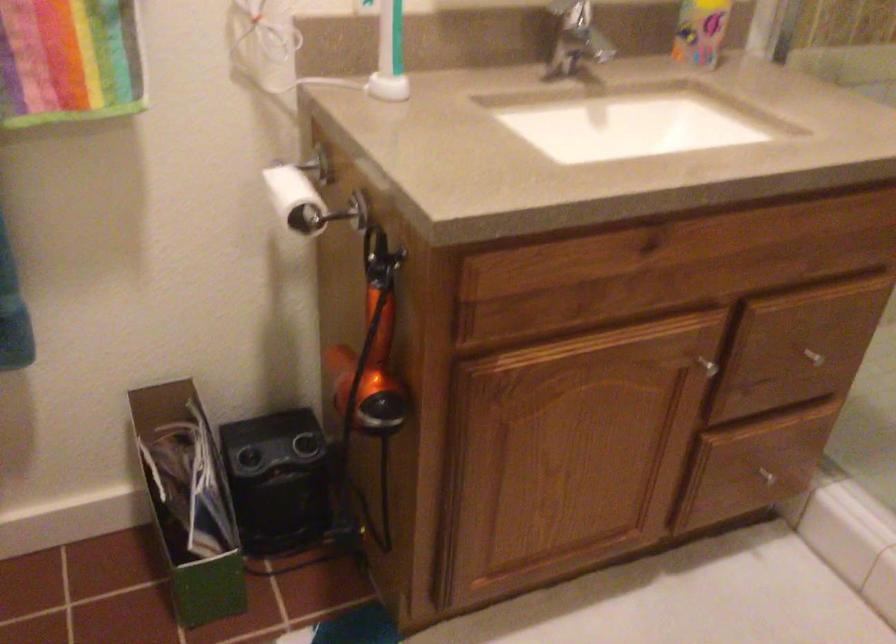
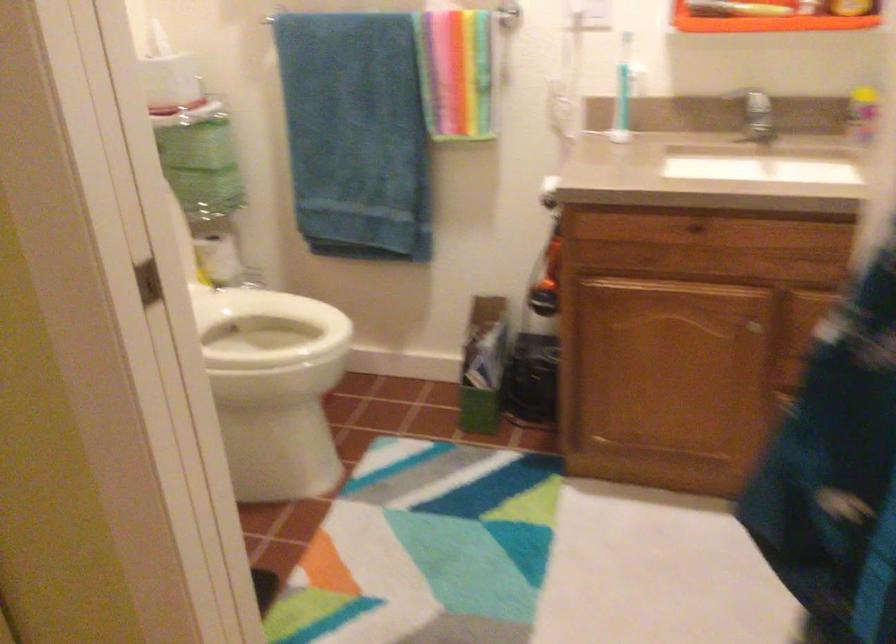
Where in the second image is the point corresponding to point (622, 251) from the first image?

(692, 229)